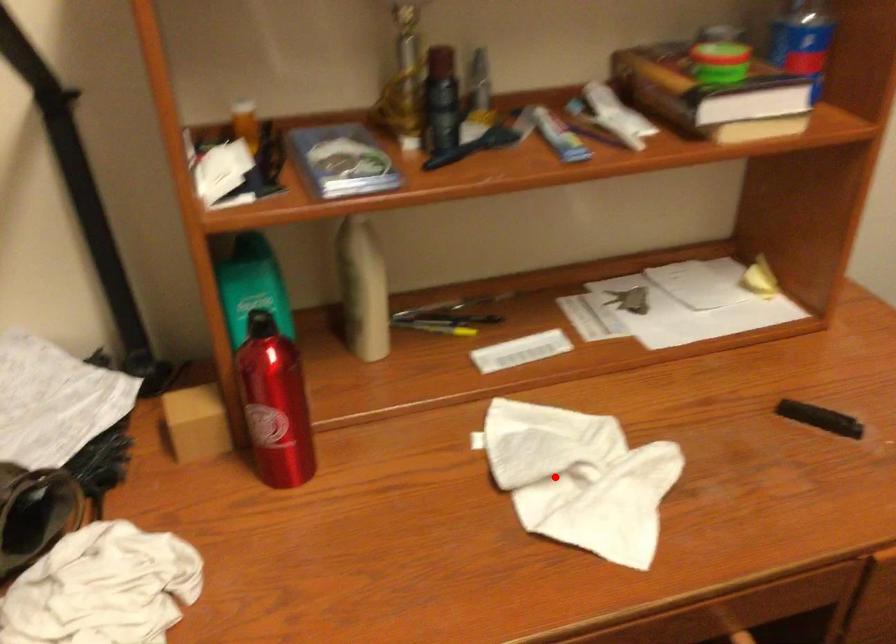
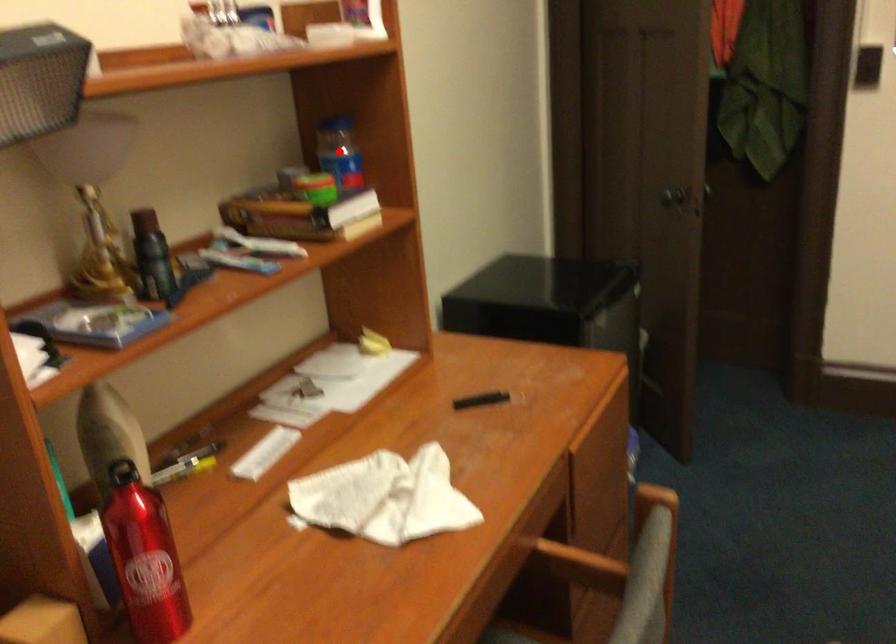
I am providing you with two images of the same scene from different viewpoints. A red point is marked on the first image and another point is marked on the second image. Are the points marked in image1 and image2 representing the same 3D position?

No